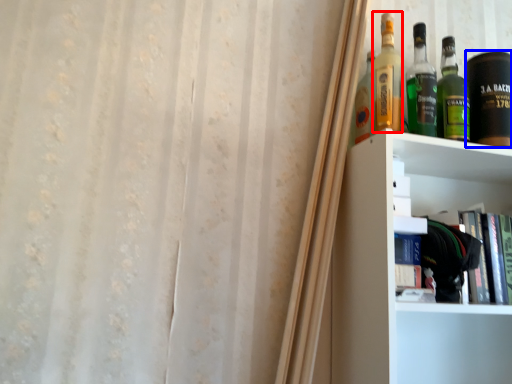
Question: Which point is further to the camera, bottle (highlighted by a red box) or beverage (highlighted by a blue box)?

Choices:
 (A) bottle
 (B) beverage

Answer: (B)